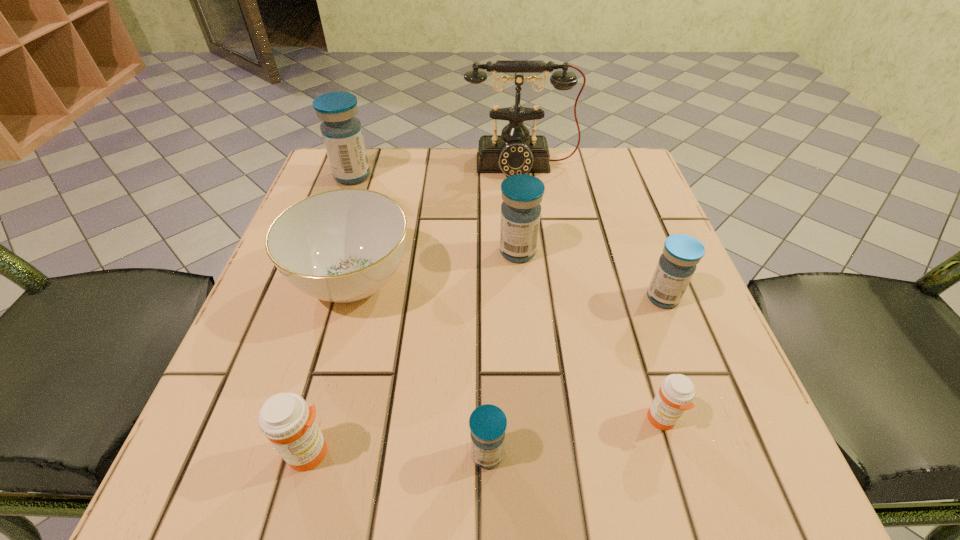
Locate an element on the screen. The width and height of the screenshot is (960, 540). free location located 0.070m on the front of the fifth medicine from left to right is located at coordinates (684, 491).

Identify the location of vacant space located on the right of the smallest blue medicine. (741, 454).

What are the coordinates of `telephone located in the far edge section of the desktop` in the screenshot? It's located at (515, 151).

The image size is (960, 540). Find the location of `medicine that is at the far edge`. medicine that is at the far edge is located at coordinates (342, 134).

I want to click on chinaware that is at the left edge, so click(343, 245).

Image resolution: width=960 pixels, height=540 pixels. What are the coordinates of `telephone positioned at the right edge` in the screenshot? It's located at (515, 151).

Where is `object located at the far left corner`? Image resolution: width=960 pixels, height=540 pixels. object located at the far left corner is located at coordinates (342, 134).

You are a GUI agent. You are given a task and a screenshot of the screen. Output one action in this format:
    pyautogui.click(x=<x>, y=<y>)
    Task: Click on the object that is at the near left corner
    The height and width of the screenshot is (540, 960).
    Given the screenshot: What is the action you would take?
    pyautogui.click(x=285, y=419)

This screenshot has height=540, width=960. Find the location of `object situated at the far right corner`. object situated at the far right corner is located at coordinates (515, 151).

Image resolution: width=960 pixels, height=540 pixels. What are the coordinates of `object located at the near right corner` in the screenshot? It's located at (676, 393).